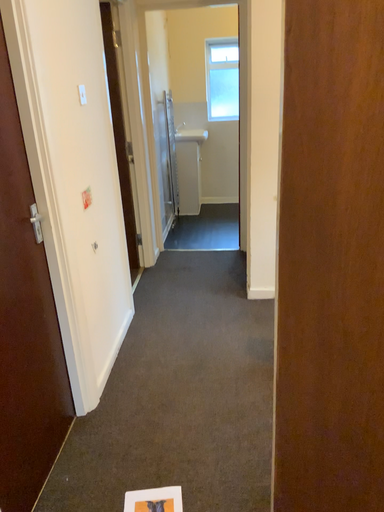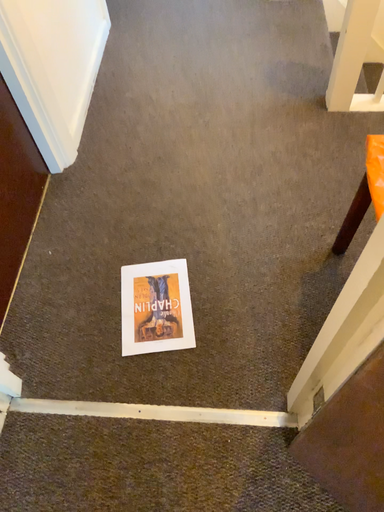
Question: Which way did the camera rotate in the video?

Choices:
 (A) rotated upward
 (B) rotated downward

Answer: (B)